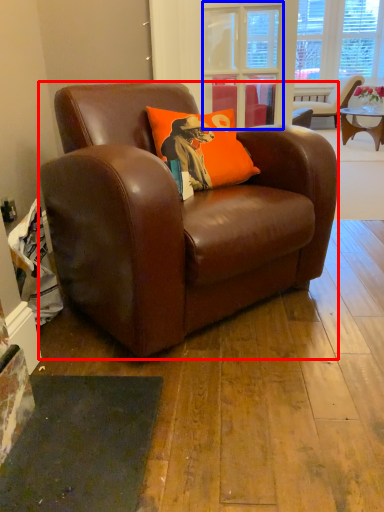
Question: Which object is closer to the camera taking this photo, chair (highlighted by a red box) or glass door (highlighted by a blue box)?

Choices:
 (A) chair
 (B) glass door

Answer: (A)